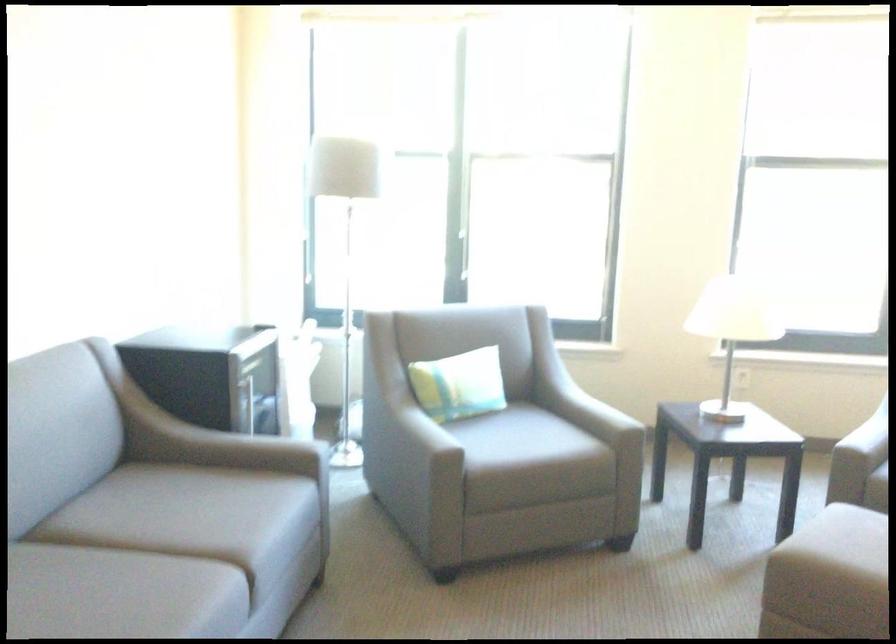
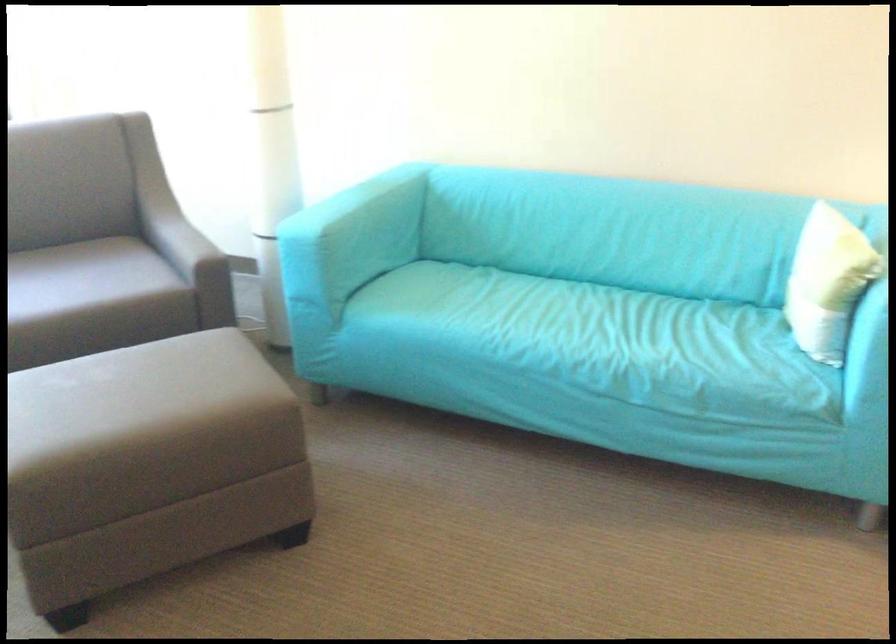
Based on the continuous images, in which direction is the camera rotating?

The camera's rotation is toward right-down.